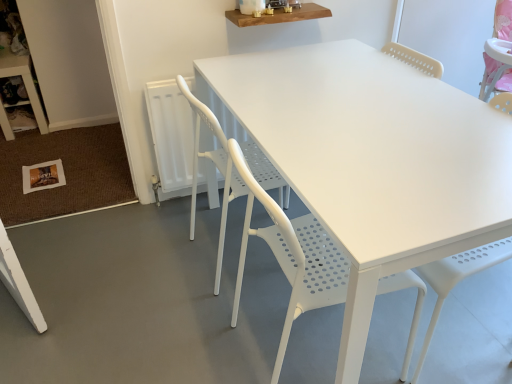
The image size is (512, 384). I want to click on vacant point to the left of white perforated plastic chair at center, marked as the second chair in a front-to-back arrangement, so click(155, 256).